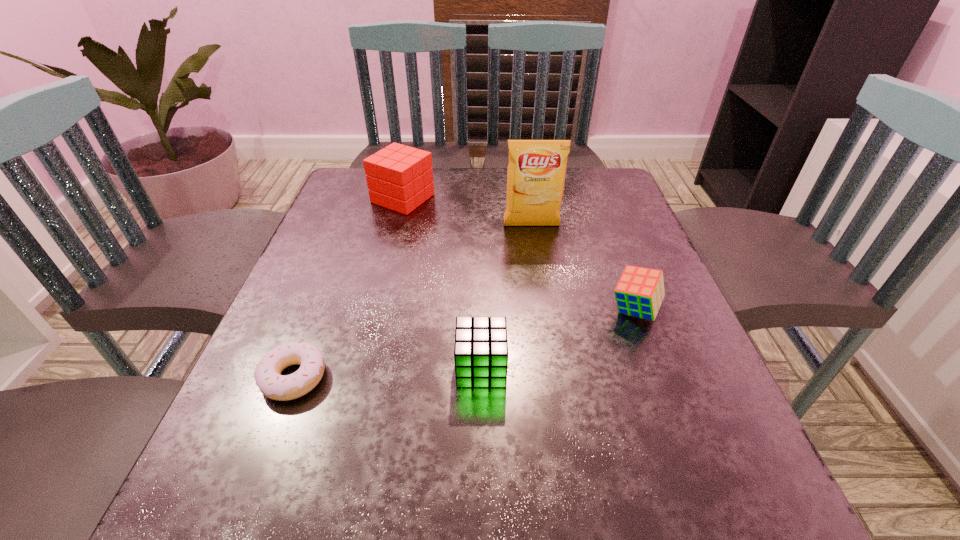
You are a GUI agent. You are given a task and a screenshot of the screen. Output one action in this format:
    pyautogui.click(x=<x>, y=<y>)
    Task: Click on the free spot located on the front of the tallest cube
    The image size is (960, 540).
    Given the screenshot: What is the action you would take?
    370,329

Where is `vacant area situated 0.310m on the left of the second nearest cube`? vacant area situated 0.310m on the left of the second nearest cube is located at coordinates (445, 310).

Find the location of a particular element. The width and height of the screenshot is (960, 540). vacant space located on the front of the third object from right to left is located at coordinates (481, 496).

Find the location of a particular element. This screenshot has height=540, width=960. free space located 0.320m on the back of the shortest object is located at coordinates (346, 242).

This screenshot has height=540, width=960. In order to click on object at the far edge in this screenshot , I will do `click(399, 177)`.

At what (x,y) coordinates should I click in order to perform the action: click on cube located in the left edge section of the desktop. Please return your answer as a coordinate pair (x, y). This screenshot has height=540, width=960. Looking at the image, I should click on (399, 177).

Find the location of a particular element. This screenshot has height=540, width=960. doughnut at the left edge is located at coordinates (268, 378).

Where is `object that is at the right edge`? Image resolution: width=960 pixels, height=540 pixels. object that is at the right edge is located at coordinates (639, 292).

This screenshot has height=540, width=960. I want to click on object that is positioned at the far left corner, so click(399, 177).

The image size is (960, 540). Find the location of `vacant space at the far edge of the desktop`. vacant space at the far edge of the desktop is located at coordinates (561, 214).